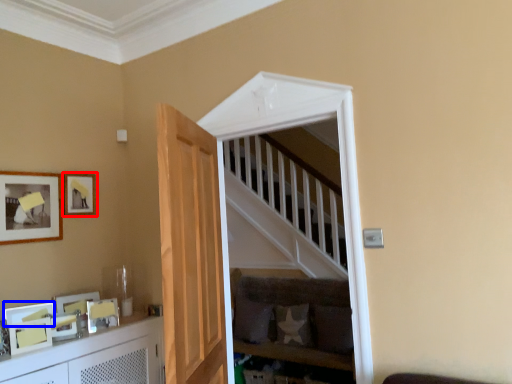
Question: Which object is further to the camera taking this photo, picture frame (highlighted by a red box) or picture frame (highlighted by a blue box)?

Choices:
 (A) picture frame
 (B) picture frame

Answer: (A)